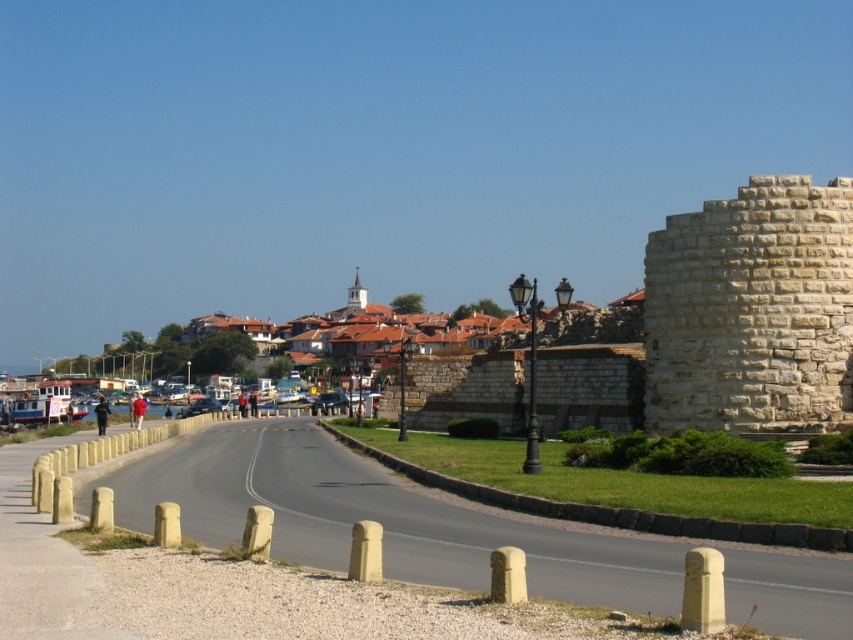
You are a tourist standing on the grassy area near the low stone wall with bollards. You want to take a photo that includes both the white stone tower at right and the white stone tower at center. Which tower should you position closer to the foreground to include both in your shot?

The white stone tower at right is below the white stone tower at center. To include both in the photo, position the camera closer to the foreground so the white stone tower at right is in the front and the white stone tower at center is in the background.

You are a tourist standing on the grassy area near the road and want to take a photo of both the white stone tower at right and the white stone tower at center. Which tower should you position yourself closer to in order to capture both in the same frame?

To capture both the white stone tower at right and the white stone tower at center in the same frame, you should position yourself closer to the white stone tower at center since the white stone tower at right is positioned on the right side of it.

You are a tourist standing on the grassy area near the black lamppost. You want to take a photo of both the white stone tower at right and the white stone tower at center. Which tower should you move towards to get both in the frame without one blocking the other?

You should move towards the white stone tower at right because it is in front of the white stone tower at center. By moving closer to the front tower, you can position yourself so both towers are visible without the closer one blocking the farther one.